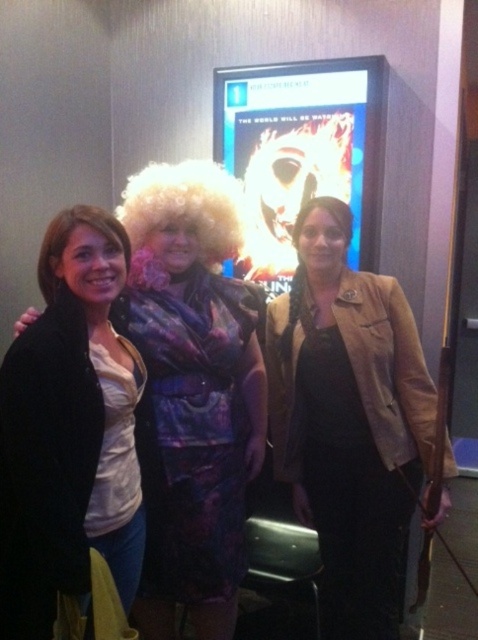
Does curly blonde wig at center appear under blonde curly wig at center?

Actually, curly blonde wig at center is above blonde curly wig at center.

Is curly blonde wig at center to the left of blonde curly wig at center from the viewer's perspective?

Indeed, curly blonde wig at center is positioned on the left side of blonde curly wig at center.

Identify the location of curly blonde wig at center. The image size is (478, 640). (186, 205).

Locate an element on the screen. The height and width of the screenshot is (640, 478). curly blonde wig at center is located at coordinates (186, 205).

Does shiny purple dress at center appear under blonde synthetic wig at left?

Yes, shiny purple dress at center is below blonde synthetic wig at left.

Who is more distant from viewer, [122,212] or [46,291]?

The point [122,212] is more distant.

Where is `shiny purple dress at center`? The image size is (478, 640). shiny purple dress at center is located at coordinates (193, 388).

Between point (382, 596) and point (60, 301), which one is positioned behind?

Point (382, 596)

Describe the element at coordinates (348, 422) in the screenshot. This screenshot has height=640, width=478. I see `tan leather jacket at center` at that location.

Locate an element on the screen. The width and height of the screenshot is (478, 640). tan leather jacket at center is located at coordinates (348, 422).